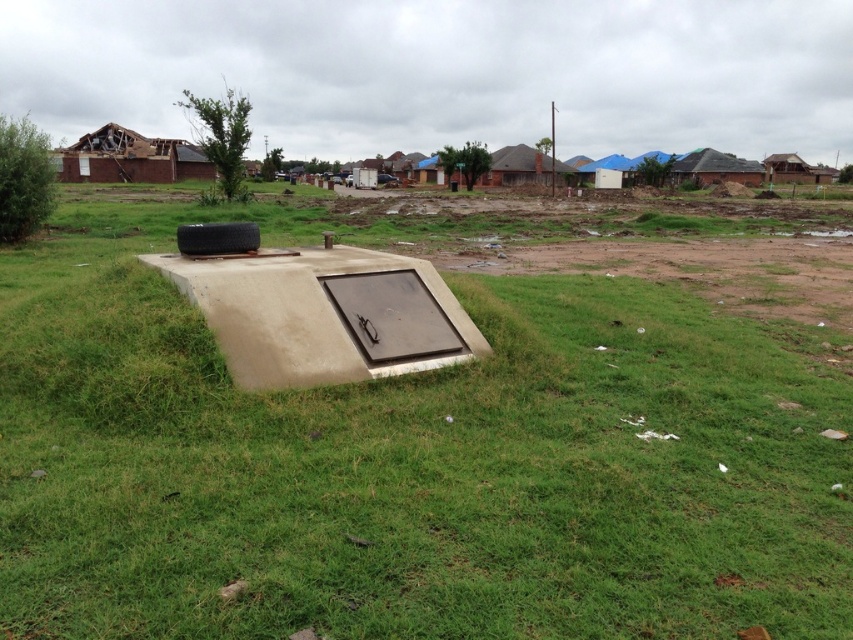
Question: Which of the following is the farthest from the observer?

Choices:
 (A) concrete at center
 (B) brown corrugated roof at upper right

Answer: (B)

Question: Is the position of concrete at center more distant than that of brown corrugated roof at upper right?

Choices:
 (A) yes
 (B) no

Answer: (B)

Question: Is concrete at center closer to camera compared to brown corrugated roof at upper right?

Choices:
 (A) no
 (B) yes

Answer: (B)

Question: Which point is closer to the camera taking this photo?

Choices:
 (A) pos(693,182)
 (B) pos(294,397)
 (C) pos(76,168)

Answer: (B)

Question: Is concrete at center bigger than brick house at upper left?

Choices:
 (A) no
 (B) yes

Answer: (A)

Question: Which is nearer to the brown corrugated roof at upper right?

Choices:
 (A) brick house at upper left
 (B) concrete at center

Answer: (A)